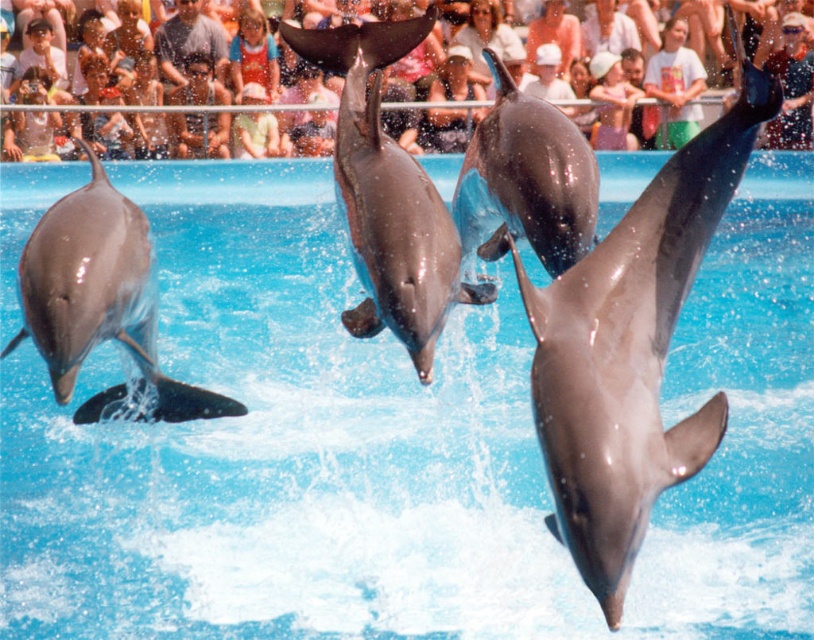
You are a photographer standing behind the metal railing at the dolphin show. You want to take a closeup photo of the smooth gray dolphin at center. The camera you are using has a minimum focusing distance of 15 feet. Will you be able to take the photo without moving closer?

The distance between the smooth gray dolphin at center and the camera is 14.09 feet, which is less than the camera minimum focusing distance of 15 feet. Therefore, you can take the photo without moving closer.

You are a photographer trying to capture the dolphins in the foreground while ensuring the light blue denim shirt at upper center and the matte plastic crowd at upper center are visible in the background. Which object should you focus on to ensure both the foreground and background elements are in frame?

The matte plastic crowd at upper center is wider than the light blue denim shirt at upper center, so focusing on the matte plastic crowd at upper center will ensure both the foreground dolphins and the background elements are within the frame.

You are standing at the center of the pool and want to locate the smooth gray dolphin at center. Which direction should you look to find it?

The smooth gray dolphin at center is located at point coordinates of (x=387, y=195), so you should look towards the center of the pool to find it.